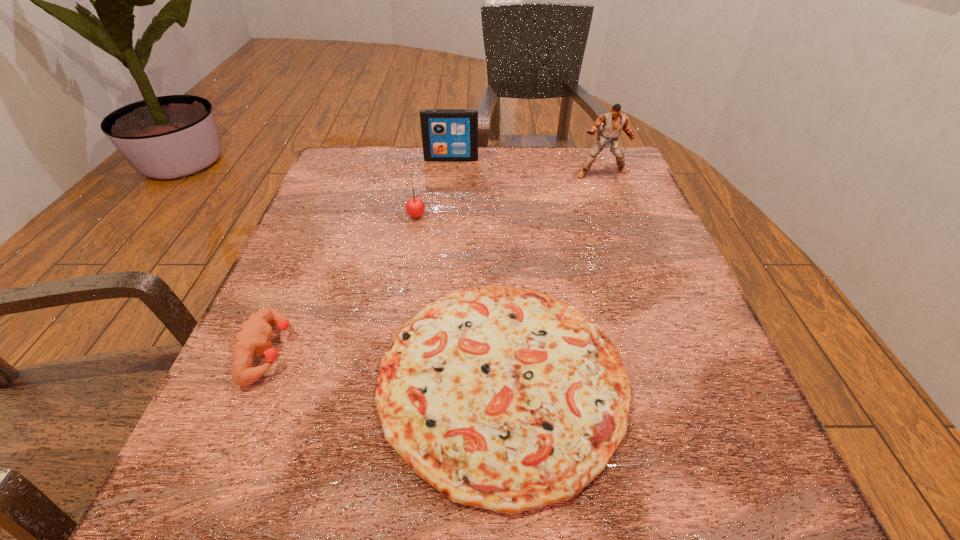
The image size is (960, 540). Find the location of `free space that satisfies the following two spatial constraints: 1. on the front-facing side of the taller puncher; 2. with the gloves of the leftmost object facing forward`. free space that satisfies the following two spatial constraints: 1. on the front-facing side of the taller puncher; 2. with the gloves of the leftmost object facing forward is located at coordinates (668, 351).

At what (x,y) coordinates should I click in order to perform the action: click on vacant space that satisfies the following two spatial constraints: 1. on the front screen of the fourth shortest object; 2. with the gloves of the nearer puncher facing forward. Please return your answer as a coordinate pair (x, y). Looking at the image, I should click on point(433,351).

In order to click on vacant area that satisfies the following two spatial constraints: 1. on the front screen of the fourth shortest object; 2. on the left side of the pizza in this screenshot , I will do `click(430, 380)`.

Image resolution: width=960 pixels, height=540 pixels. What are the coordinates of `vacant space that satisfies the following two spatial constraints: 1. with the gloves of the nearer puncher facing forward; 2. on the left side of the pizza` in the screenshot? It's located at (256, 380).

I want to click on free space in the image that satisfies the following two spatial constraints: 1. on the front screen of the iPod; 2. on the right side of the pizza, so pos(430,380).